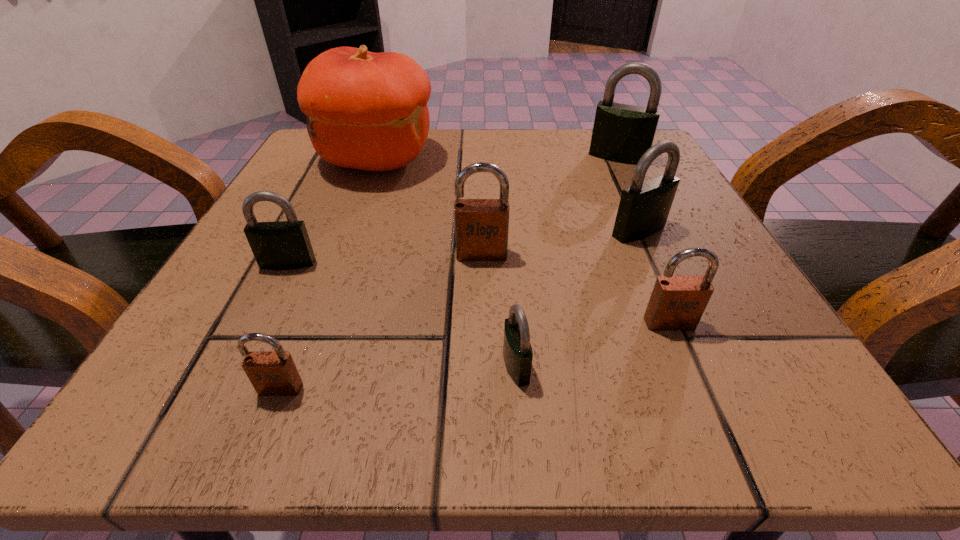
You are a GUI agent. You are given a task and a screenshot of the screen. Output one action in this format:
    pyautogui.click(x=<x>, y=<y>)
    Task: Click on the pumpkin
    
    Given the screenshot: What is the action you would take?
    pyautogui.click(x=368, y=111)

The image size is (960, 540). Identify the location of the biggest black padlock. (622, 133).

Find the location of `the farthest padlock`. the farthest padlock is located at coordinates (622, 133).

This screenshot has width=960, height=540. I want to click on the third farthest object, so click(644, 207).

Locate an element on the screen. The image size is (960, 540). the third smallest black padlock is located at coordinates (644, 207).

Locate an element on the screen. the second brown padlock from right to left is located at coordinates (481, 225).

I want to click on the biggest brown padlock, so click(481, 225).

At what (x,y) coordinates should I click in order to perform the action: click on the second smallest black padlock. Please return your answer as a coordinate pair (x, y). The image size is (960, 540). Looking at the image, I should click on (284, 245).

Identify the location of the leftmost black padlock. (284, 245).

You are a GUI agent. You are given a task and a screenshot of the screen. Output one action in this format:
    pyautogui.click(x=<x>, y=<y>)
    Task: Click on the third nearest object
    This screenshot has width=960, height=540.
    Given the screenshot: What is the action you would take?
    pyautogui.click(x=677, y=302)